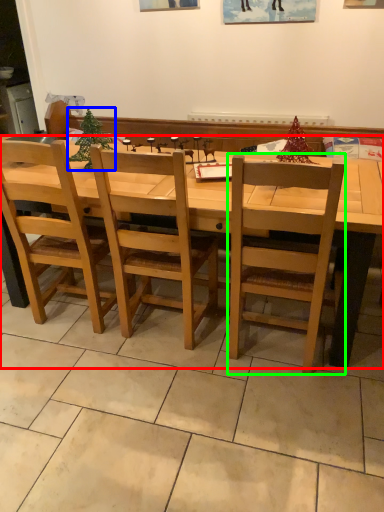
Question: Estimate the real-world distances between objects in this image. Which object is farther from desk (highlighted by a red box), christmas tree (highlighted by a blue box) or chair (highlighted by a green box)?

Choices:
 (A) christmas tree
 (B) chair

Answer: (A)